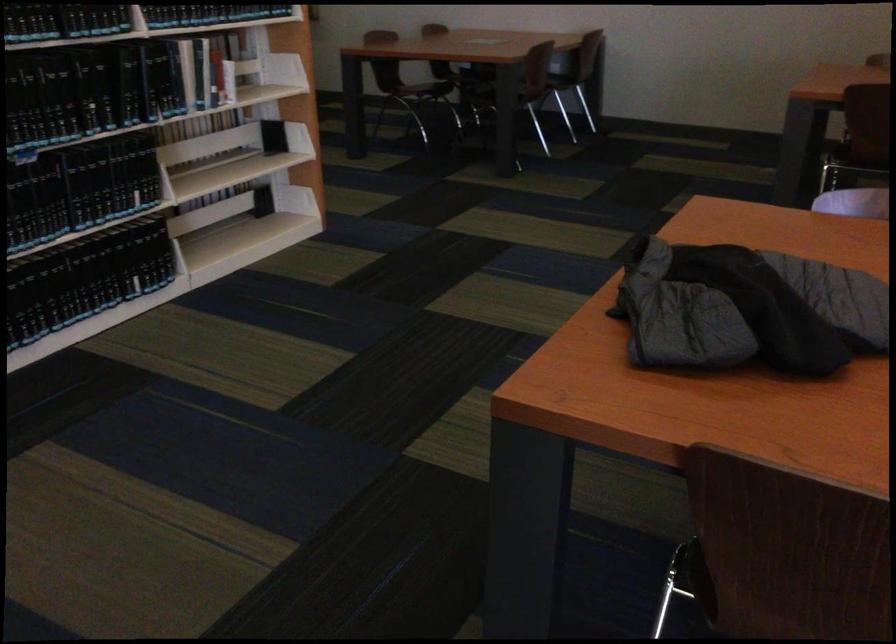
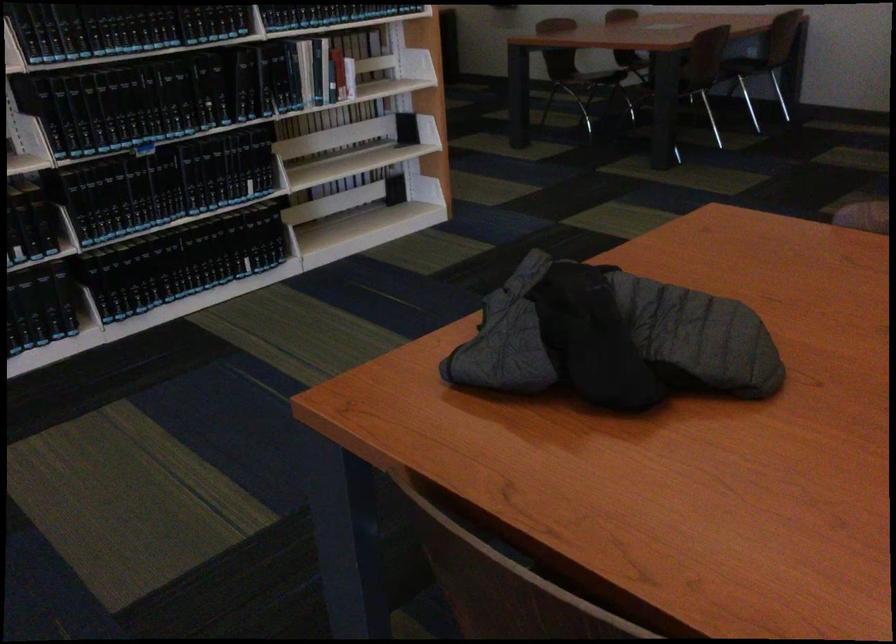
Question: Which direction would the cameraman need to move to produce the second image? Reply with the corresponding letter.

Choices:
 (A) Left
 (B) Right
 (C) Forward
 (D) Backward

Answer: (B)